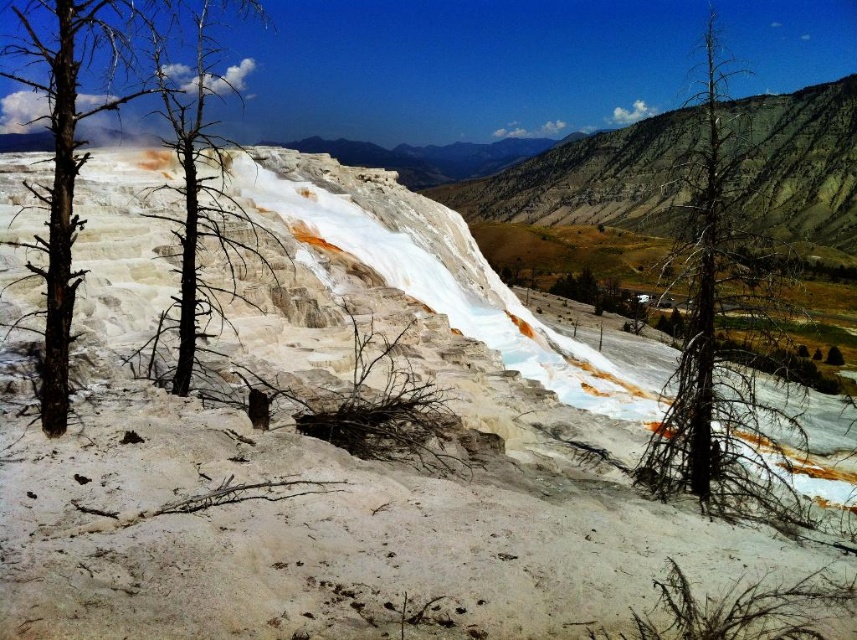
Is dead wood tree at center to the right of black dead tree at center from the viewer's perspective?

Yes, dead wood tree at center is to the right of black dead tree at center.

You are a GUI agent. You are given a task and a screenshot of the screen. Output one action in this format:
    pyautogui.click(x=<x>, y=<y>)
    Task: Click on the dead wood tree at center
    This screenshot has height=640, width=857.
    Given the screenshot: What is the action you would take?
    pyautogui.click(x=715, y=346)

Where is `dead wood tree at center`? The width and height of the screenshot is (857, 640). dead wood tree at center is located at coordinates (715, 346).

Does charred wood tree at left have a smaller size compared to black dead tree at center?

Correct, charred wood tree at left occupies less space than black dead tree at center.

Describe the element at coordinates (70, 140) in the screenshot. The image size is (857, 640). I see `charred wood tree at left` at that location.

The image size is (857, 640). Identify the location of charred wood tree at left. (70, 140).

How distant is dead wood tree at center from charred wood tree at left?

dead wood tree at center is 896.12 feet away from charred wood tree at left.

Who is lower down, dead wood tree at center or charred wood tree at left?

Positioned lower is charred wood tree at left.

Does point (735, 388) come closer to viewer compared to point (61, 380)?

No, (735, 388) is behind (61, 380).

Find the location of a particular element. dead wood tree at center is located at coordinates (715, 346).